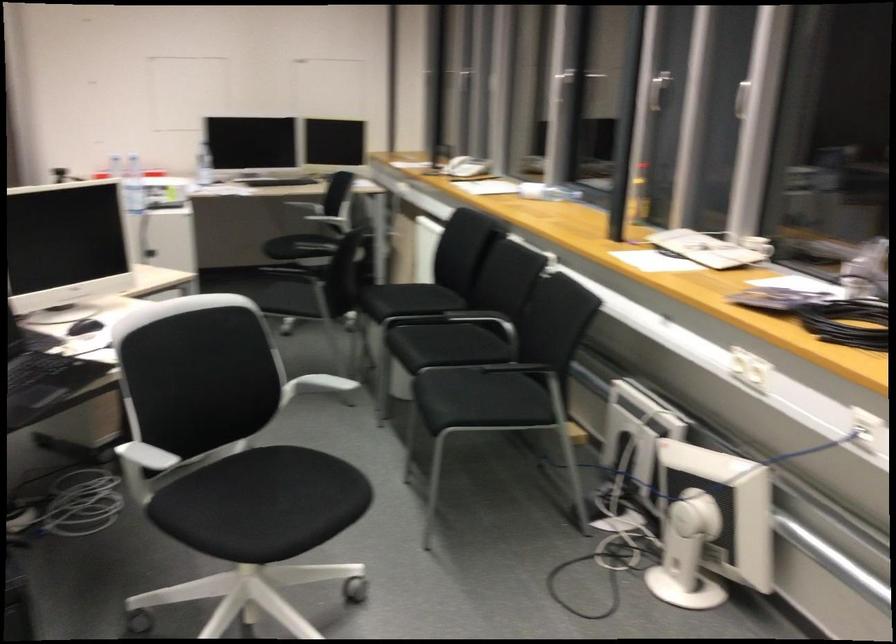
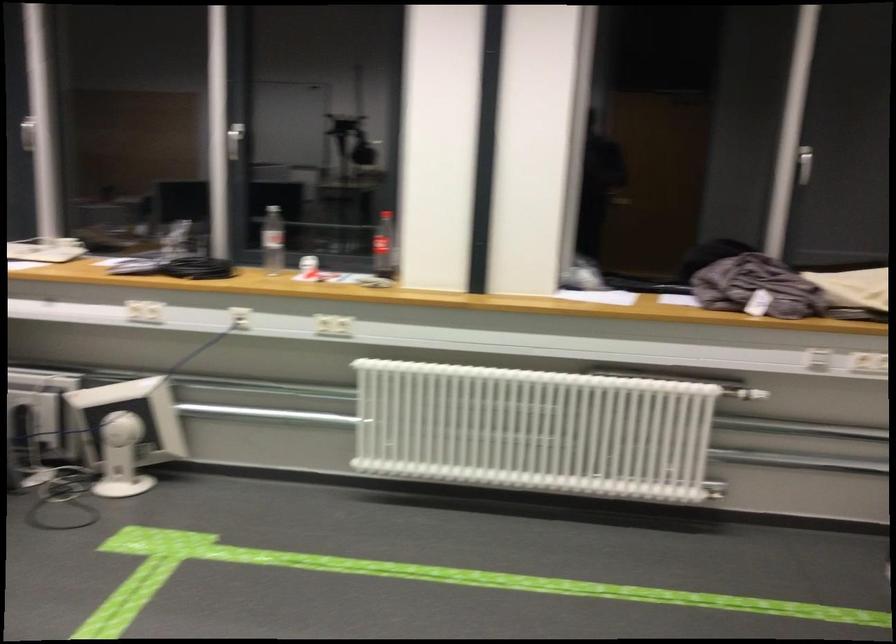
Find the pixel in the second image that matches [694,524] in the first image.

(126, 431)